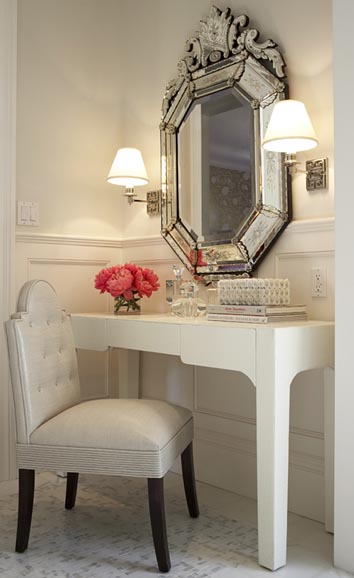
Find the location of `mirror`. mirror is located at coordinates (222, 190).